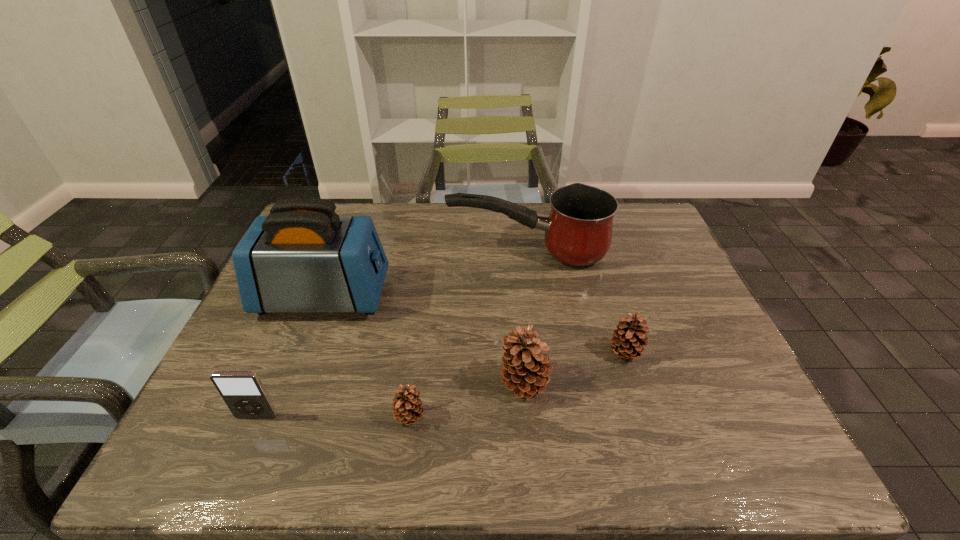
Identify the location of free space located on the right of the rightmost pinecone. The width and height of the screenshot is (960, 540). (664, 353).

Where is `free location located on the handle side of the saucepan`? This screenshot has height=540, width=960. free location located on the handle side of the saucepan is located at coordinates (348, 252).

This screenshot has height=540, width=960. What are the coordinates of `vacant region located on the handle side of the saucepan` in the screenshot? It's located at (421, 252).

Where is `vacant space located on the handle side of the saucepan`? vacant space located on the handle side of the saucepan is located at coordinates (421, 252).

The image size is (960, 540). I want to click on vacant space situated 0.230m on the front-facing side of the toaster, so click(x=471, y=296).

I want to click on object that is positioned at the far edge, so click(x=578, y=231).

The height and width of the screenshot is (540, 960). I want to click on iPod that is at the near edge, so click(243, 392).

Locate an element on the screen. Image resolution: width=960 pixels, height=540 pixels. toaster present at the left edge is located at coordinates (303, 257).

The height and width of the screenshot is (540, 960). I want to click on iPod located in the left edge section of the desktop, so click(243, 392).

Locate an element on the screen. object that is at the near left corner is located at coordinates coord(243,392).